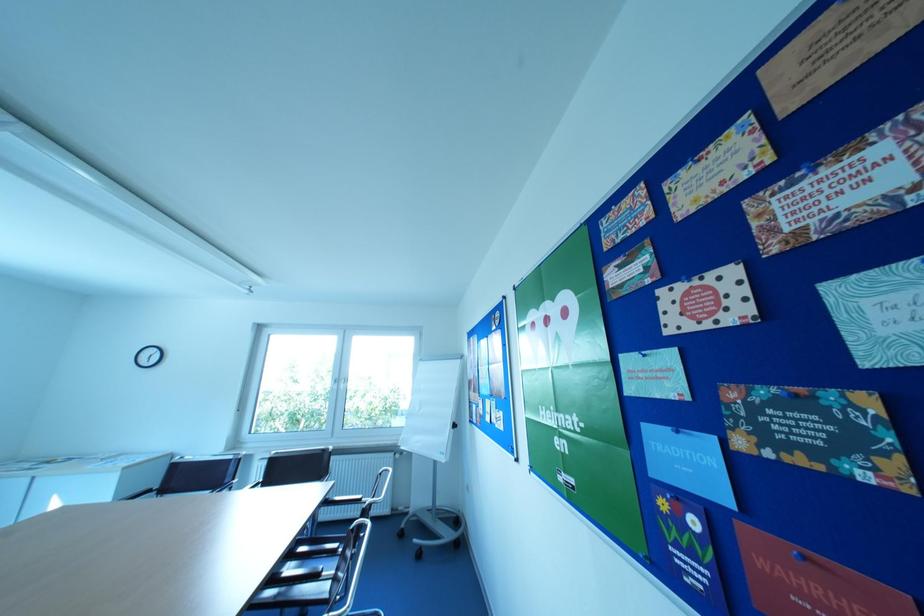
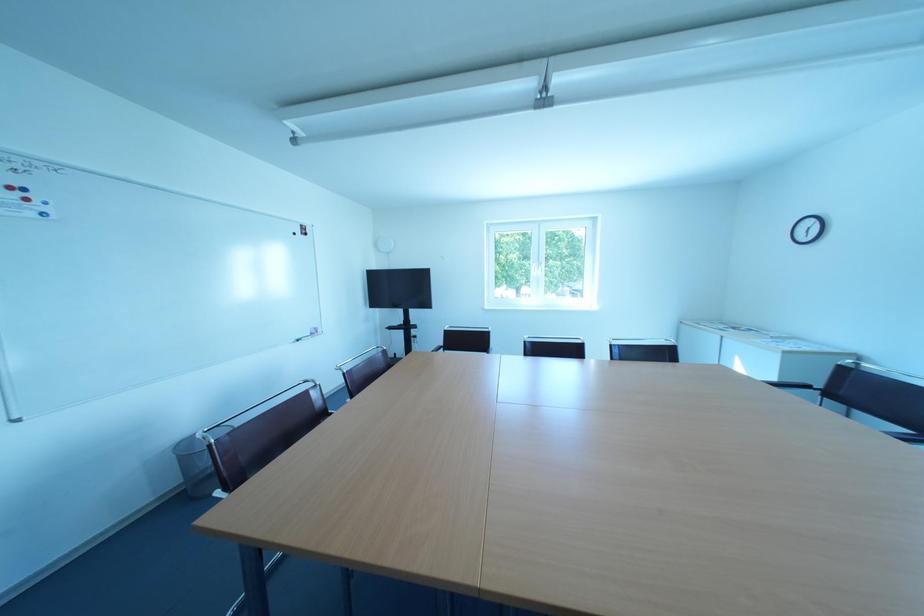
Question: The camera is either moving clockwise (left) or counter-clockwise (right) around the object. The first image is from the beginning of the video and the second image is from the end. Is the camera moving left or right when shooting the video?

Choices:
 (A) Left
 (B) Right

Answer: (B)